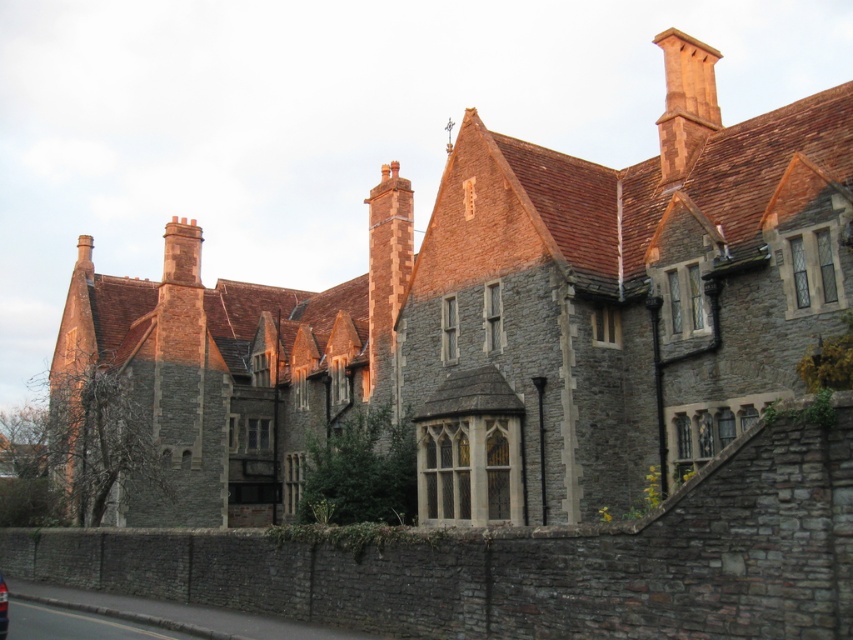
Question: Can you confirm if smooth terracotta chimney at upper right is positioned to the left of matte black car at lower left?

Choices:
 (A) yes
 (B) no

Answer: (B)

Question: Is brick chimney at center further to the viewer compared to matte black car at lower left?

Choices:
 (A) yes
 (B) no

Answer: (A)

Question: Which object is positioned farthest from the smooth terracotta chimney at upper right?

Choices:
 (A) matte black car at lower left
 (B) brick chimney at center

Answer: (A)

Question: Which point appears farthest from the camera in this image?

Choices:
 (A) (3, 632)
 (B) (689, 90)
 (C) (380, 333)

Answer: (C)

Question: Does brick chimney at center appear under matte black car at lower left?

Choices:
 (A) no
 (B) yes

Answer: (A)

Question: Which of the following is the closest to the observer?

Choices:
 (A) (672, 150)
 (B) (393, 397)
 (C) (7, 608)

Answer: (C)